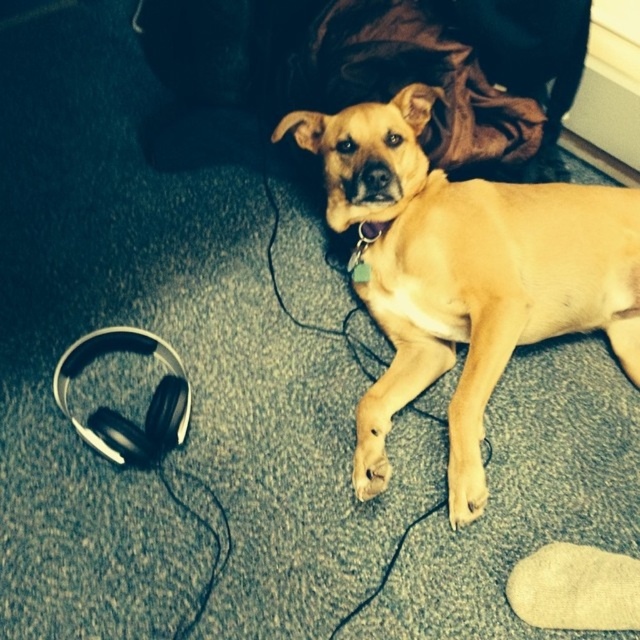
Between point (544, 333) and point (170, 424), which one is positioned behind?

The point (544, 333) is behind.

Identify the location of golden matte dog at center. This screenshot has height=640, width=640. (468, 253).

The width and height of the screenshot is (640, 640). In order to click on golden matte dog at center in this screenshot , I will do `click(468, 253)`.

Consider the image. Is black matte headphones at lower left bigger than light brown fur paw at lower center?

Yes, black matte headphones at lower left is bigger than light brown fur paw at lower center.

Between black matte headphones at lower left and light brown fur paw at lower center, which one has less height?

light brown fur paw at lower center is shorter.

Is point (182, 413) more distant than point (381, 476)?

Yes, it is.

The image size is (640, 640). I want to click on black matte headphones at lower left, so click(x=118, y=412).

Locate an element on the screen. Image resolution: width=640 pixels, height=640 pixels. golden matte dog at center is located at coordinates pyautogui.click(x=468, y=253).

Which is above, golden matte dog at center or light brown fur paw at lower center?

Positioned higher is golden matte dog at center.

The image size is (640, 640). What are the coordinates of `golden matte dog at center` in the screenshot? It's located at (468, 253).